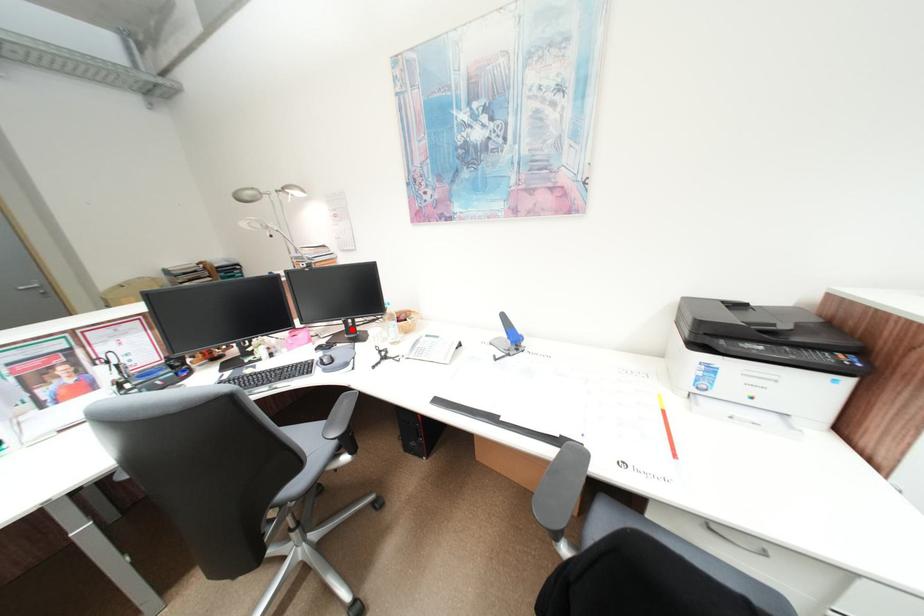
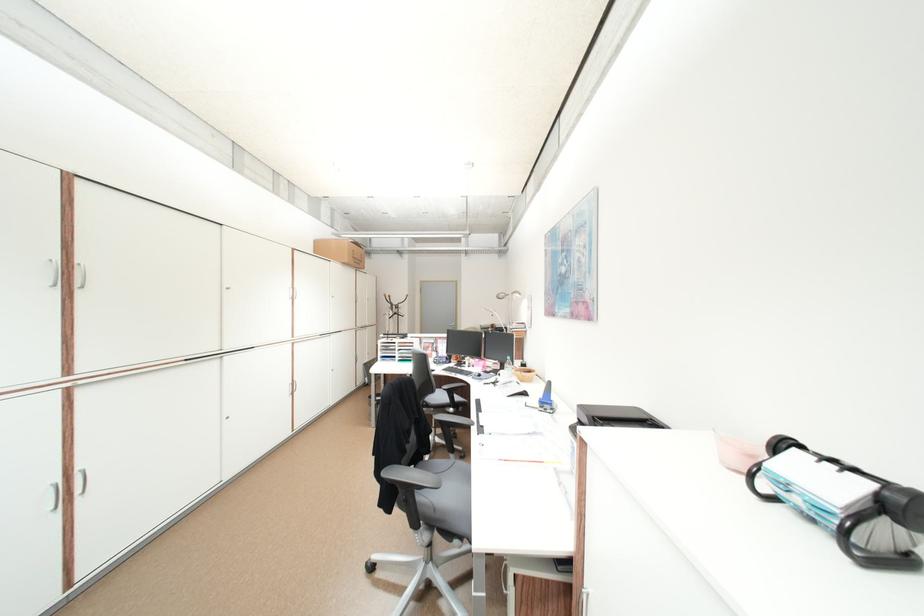
The point at the highlighted location is marked in the first image. Where is the corresponding point in the second image?

(507, 368)